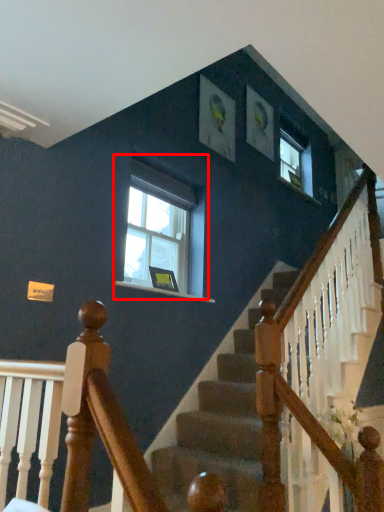
Question: Where is window (annotated by the red box) located in relation to picture frame in the image?

Choices:
 (A) right
 (B) left

Answer: (B)